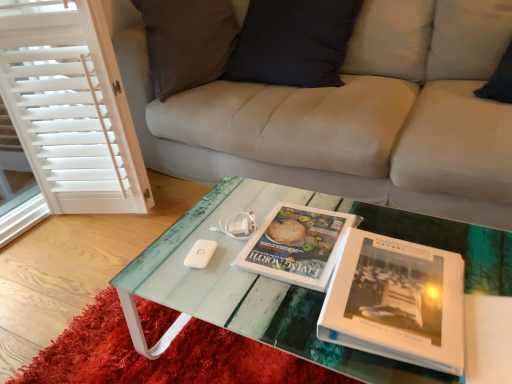
Question: Is matte white book at center, the second book in the front-to-back sequence, wider or thinner than white matte game controller at center?

Choices:
 (A) wide
 (B) thin

Answer: (A)

Question: In terms of size, does matte white book at center, the second book in the front-to-back sequence, appear bigger or smaller than white matte game controller at center?

Choices:
 (A) big
 (B) small

Answer: (A)

Question: Which of these objects is positioned farthest from the white glossy book at center, which is the second book from back to front?

Choices:
 (A) translucent glass coffee table at center
 (B) matte white book at center, the first book positioned from the back
 (C) white matte game controller at center
 (D) translucent glass table at center
 (E) white wood screen door at left

Answer: (E)

Question: Estimate the real-world distances between objects in this image. Which object is farther from the translucent glass table at center?

Choices:
 (A) matte white book at center, the second book in the front-to-back sequence
 (B) white glossy book at center, the 1th book positioned from the front
 (C) white matte game controller at center
 (D) white wood screen door at left
 (E) translucent glass coffee table at center

Answer: (D)